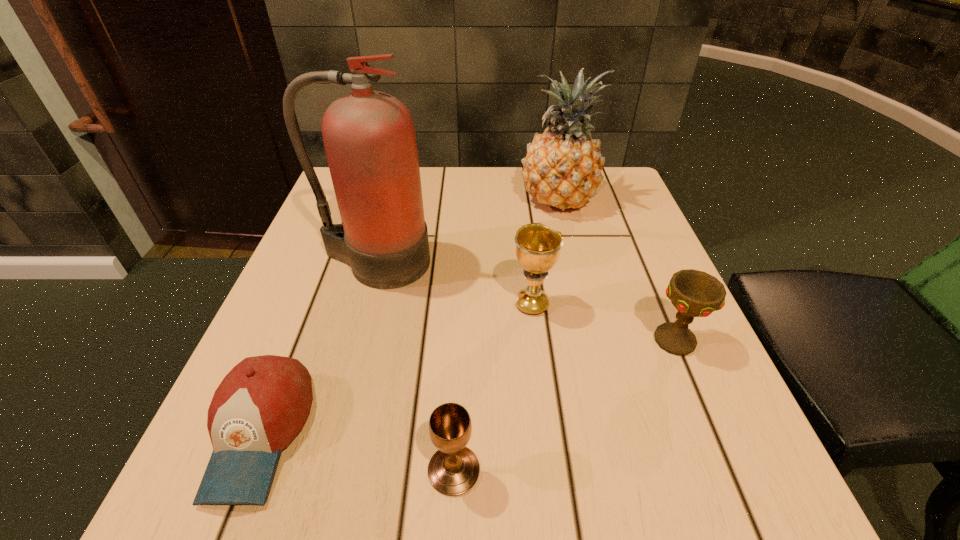
Image resolution: width=960 pixels, height=540 pixels. What are the coordinates of `fire extinguisher` in the screenshot? It's located at (369, 137).

The width and height of the screenshot is (960, 540). In order to click on pineapple in this screenshot , I will do `click(562, 168)`.

At what (x,y) coordinates should I click in order to perform the action: click on the farthest object. Please return your answer as a coordinate pair (x, y). Looking at the image, I should click on (562, 168).

Locate an element on the screen. This screenshot has height=540, width=960. the second chalice from left to right is located at coordinates (538, 247).

This screenshot has width=960, height=540. What are the coordinates of `the fourth shortest object` in the screenshot? It's located at (538, 247).

Find the location of a particular element. The width and height of the screenshot is (960, 540). the rightmost chalice is located at coordinates (693, 293).

You are a GUI agent. You are given a task and a screenshot of the screen. Output one action in this format:
    pyautogui.click(x=<x>, y=<y>)
    Task: Click on the second farthest chalice
    This screenshot has width=960, height=540.
    Given the screenshot: What is the action you would take?
    pyautogui.click(x=693, y=293)

Identify the location of the nearest chalice. Image resolution: width=960 pixels, height=540 pixels. point(453,470).

The image size is (960, 540). Identify the location of the fourth object from right to left. (453, 470).

The height and width of the screenshot is (540, 960). Find the location of `baseball cap`. baseball cap is located at coordinates (261, 405).